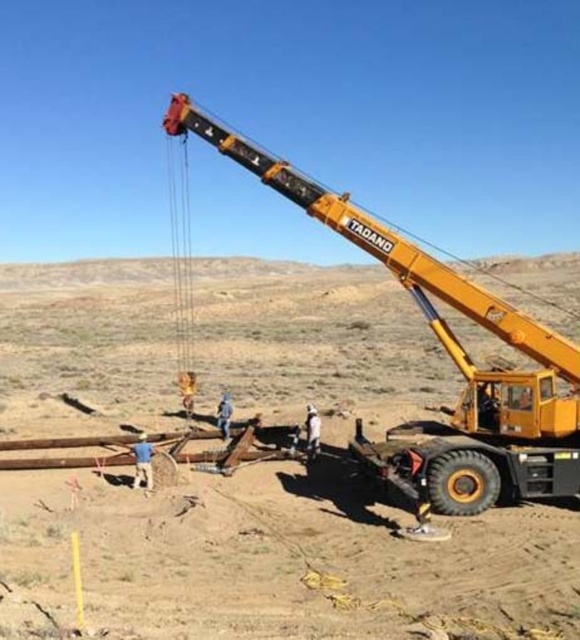
Can you confirm if dirt field at center is bigger than yellow metallic crane at upper right?

Yes.

Does dirt field at center appear on the right side of yellow metallic crane at upper right?

No, dirt field at center is not to the right of yellow metallic crane at upper right.

Find the location of a particular element. The width and height of the screenshot is (580, 640). dirt field at center is located at coordinates (280, 561).